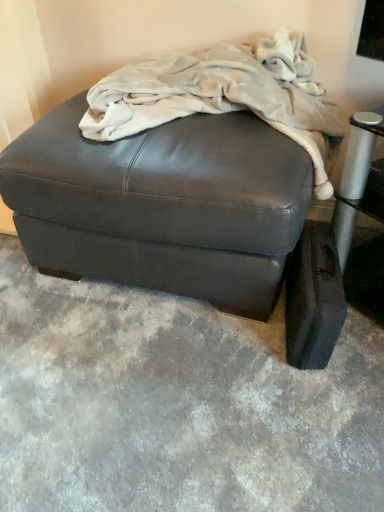
Question: Should I look upward or downward to see leather ottoman at lower right?

Choices:
 (A) up
 (B) down

Answer: (B)

Question: From a real-world perspective, is matte black ottoman at center physically above fuzzy white blanket at upper center?

Choices:
 (A) no
 (B) yes

Answer: (A)

Question: From the image's perspective, is matte black ottoman at center located beneath fuzzy white blanket at upper center?

Choices:
 (A) yes
 (B) no

Answer: (A)

Question: Considering the relative sizes of matte black ottoman at center and fuzzy white blanket at upper center in the image provided, is matte black ottoman at center bigger than fuzzy white blanket at upper center?

Choices:
 (A) no
 (B) yes

Answer: (B)

Question: Would you say matte black ottoman at center is a long distance from fuzzy white blanket at upper center?

Choices:
 (A) yes
 (B) no

Answer: (B)

Question: Can you confirm if matte black ottoman at center is positioned to the left of fuzzy white blanket at upper center?

Choices:
 (A) yes
 (B) no

Answer: (A)

Question: Is the depth of matte black ottoman at center greater than that of fuzzy white blanket at upper center?

Choices:
 (A) yes
 (B) no

Answer: (A)

Question: Does fuzzy white blanket at upper center appear on the left side of leather ottoman at lower right?

Choices:
 (A) yes
 (B) no

Answer: (A)

Question: Is the position of fuzzy white blanket at upper center less distant than that of leather ottoman at lower right?

Choices:
 (A) no
 (B) yes

Answer: (B)

Question: Is fuzzy white blanket at upper center positioned beyond the bounds of leather ottoman at lower right?

Choices:
 (A) yes
 (B) no

Answer: (A)

Question: Does fuzzy white blanket at upper center have a greater height compared to leather ottoman at lower right?

Choices:
 (A) yes
 (B) no

Answer: (A)

Question: Is fuzzy white blanket at upper center wider than leather ottoman at lower right?

Choices:
 (A) no
 (B) yes

Answer: (B)

Question: Are fuzzy white blanket at upper center and leather ottoman at lower right making contact?

Choices:
 (A) yes
 (B) no

Answer: (B)

Question: Is leather ottoman at lower right at the back of matte black ottoman at center?

Choices:
 (A) yes
 (B) no

Answer: (B)